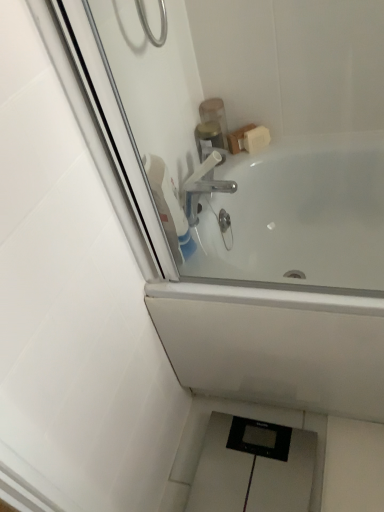
Question: From the image's perspective, is polished chrome faucet at upper center beneath translucent plastic container at upper center, positioned as the second toiletry in top-to-bottom order?

Choices:
 (A) yes
 (B) no

Answer: (A)

Question: Does polished chrome faucet at upper center have a greater width compared to translucent plastic container at upper center, positioned as the second toiletry in top-to-bottom order?

Choices:
 (A) yes
 (B) no

Answer: (B)

Question: Considering the relative positions of polished chrome faucet at upper center and translucent plastic container at upper center, the 1th toiletry positioned from the bottom, in the image provided, is polished chrome faucet at upper center in front of translucent plastic container at upper center, the 1th toiletry positioned from the bottom,?

Choices:
 (A) yes
 (B) no

Answer: (A)

Question: Is polished chrome faucet at upper center next to translucent plastic container at upper center, the 1th toiletry positioned from the bottom?

Choices:
 (A) no
 (B) yes

Answer: (A)

Question: Is polished chrome faucet at upper center smaller than translucent plastic container at upper center, the 1th toiletry positioned from the bottom?

Choices:
 (A) no
 (B) yes

Answer: (B)

Question: From a real-world perspective, relative to translucent plastic soap dispenser at upper center, placed as the 1th toiletry when sorted from top to bottom, is white plastic tap at upper center vertically above or below?

Choices:
 (A) below
 (B) above

Answer: (B)

Question: Visually, is white plastic tap at upper center positioned to the left or to the right of translucent plastic soap dispenser at upper center, placed as the 1th toiletry when sorted from top to bottom?

Choices:
 (A) right
 (B) left

Answer: (B)

Question: Considering the positions of white plastic tap at upper center and translucent plastic soap dispenser at upper center, placed as the 1th toiletry when sorted from top to bottom, in the image, is white plastic tap at upper center taller or shorter than translucent plastic soap dispenser at upper center, placed as the 1th toiletry when sorted from top to bottom,?

Choices:
 (A) short
 (B) tall

Answer: (A)

Question: Considering the positions of point (210, 188) and point (206, 100), is point (210, 188) closer or farther from the camera than point (206, 100)?

Choices:
 (A) farther
 (B) closer

Answer: (B)

Question: Is white glossy bathtub at upper center bigger or smaller than translucent plastic container at upper center, the 1th toiletry positioned from the bottom?

Choices:
 (A) small
 (B) big

Answer: (B)

Question: From a real-world perspective, is white glossy bathtub at upper center physically located above or below translucent plastic container at upper center, positioned as the second toiletry in top-to-bottom order?

Choices:
 (A) below
 (B) above

Answer: (A)

Question: Considering the positions of white glossy bathtub at upper center and translucent plastic container at upper center, positioned as the second toiletry in top-to-bottom order, in the image, is white glossy bathtub at upper center wider or thinner than translucent plastic container at upper center, positioned as the second toiletry in top-to-bottom order,?

Choices:
 (A) wide
 (B) thin

Answer: (A)

Question: Relative to translucent plastic container at upper center, positioned as the second toiletry in top-to-bottom order, is white glossy bathtub at upper center in front or behind?

Choices:
 (A) behind
 (B) front

Answer: (B)

Question: From a real-world perspective, is polished chrome faucet at upper center physically located above or below white plastic tap at upper center?

Choices:
 (A) above
 (B) below

Answer: (B)

Question: From the image's perspective, is polished chrome faucet at upper center above or below white plastic tap at upper center?

Choices:
 (A) above
 (B) below

Answer: (B)